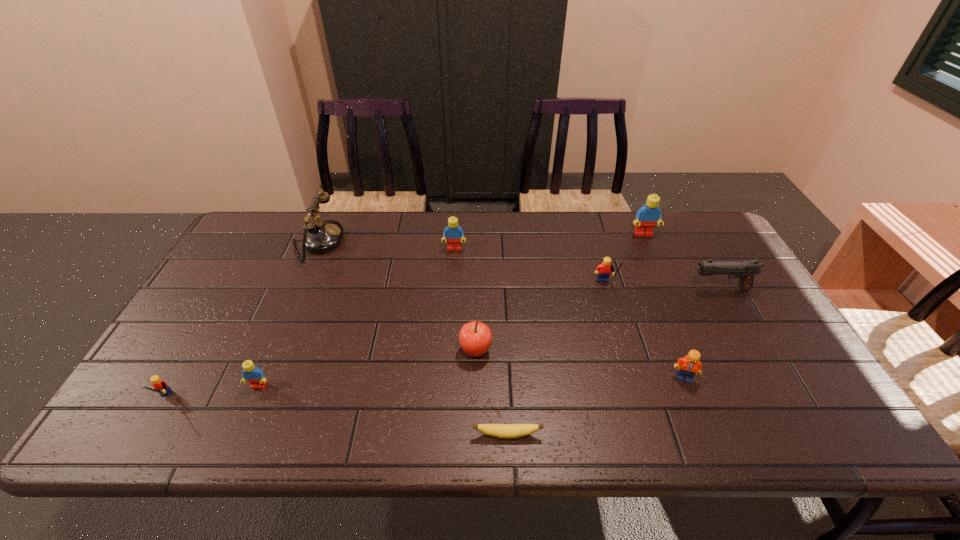
You are a GUI agent. You are given a task and a screenshot of the screen. Output one action in this format:
    pyautogui.click(x=<x>, y=<y>)
    Task: Click on the sixth farthest object
    The image size is (960, 540).
    Given the screenshot: What is the action you would take?
    pyautogui.click(x=475, y=338)

Image resolution: width=960 pixels, height=540 pixels. I want to click on orange Lego, so click(x=689, y=365).

The image size is (960, 540). What are the coordinates of `the leftmost Lego` in the screenshot? It's located at (161, 386).

Identify the location of the left yellow Lego. Image resolution: width=960 pixels, height=540 pixels. (161, 386).

Where is `the smallest blue Lego`? Image resolution: width=960 pixels, height=540 pixels. the smallest blue Lego is located at coordinates (251, 373).

Locate an element on the screen. The width and height of the screenshot is (960, 540). the nearest blue Lego is located at coordinates (251, 373).

You are a GUI agent. You are given a task and a screenshot of the screen. Output one action in this format:
    pyautogui.click(x=<x>, y=<y>)
    Task: Click on the nearest object
    This screenshot has height=540, width=960.
    Given the screenshot: What is the action you would take?
    pyautogui.click(x=505, y=431)

This screenshot has height=540, width=960. In order to click on the shortest object in this screenshot , I will do `click(505, 431)`.

What are the coordinates of `vacant space located 0.340m on the face of the farthest Lego` in the screenshot? It's located at (679, 315).

Identify the location of free space located 0.330m on the dial of the black telephone. (443, 242).